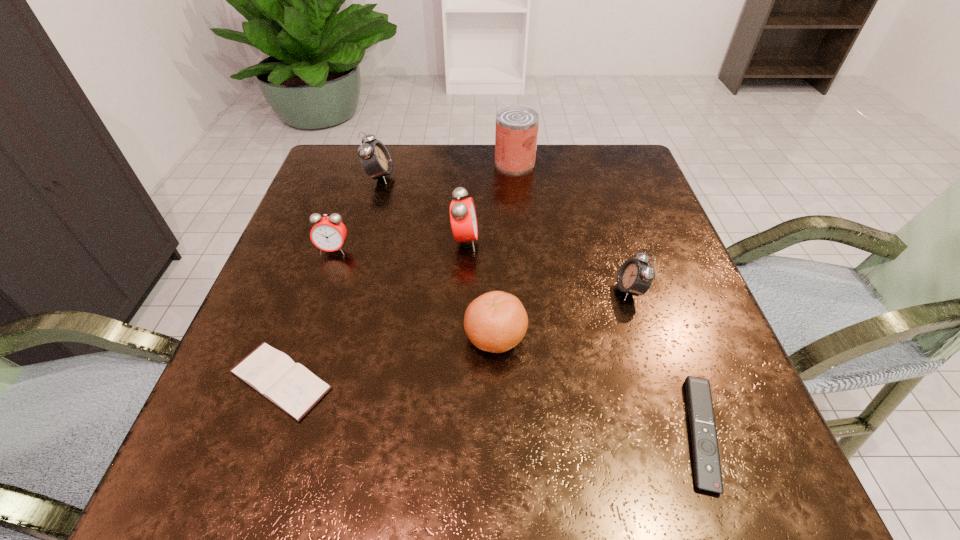
Where is `vacant region between the fifth farthest object and the diary`? This screenshot has height=540, width=960. vacant region between the fifth farthest object and the diary is located at coordinates (455, 335).

Find the location of `free area in between the farther white alarm clock and the diary`. free area in between the farther white alarm clock and the diary is located at coordinates (330, 279).

At what (x,y) coordinates should I click in order to perform the action: click on unoccupied area between the left red alarm clock and the diary. Please return your answer as a coordinate pair (x, y). Looking at the image, I should click on (307, 315).

Where is `free space between the fourth nearest object and the farther white alarm clock`? free space between the fourth nearest object and the farther white alarm clock is located at coordinates (505, 233).

Where is `empty location between the diary and the remote control`? This screenshot has height=540, width=960. empty location between the diary and the remote control is located at coordinates (491, 407).

Identify which object is the third closest to the clementine. Please provide its 2D coordinates. Your answer should be formatted as a tuple, i.e. [(x, y)], where the tuple contains the x and y coordinates of a point satisfying the conditions above.

[(290, 386)]

Identify which object is located as the sixth nearest to the remote control. Please provide its 2D coordinates. Your answer should be formatted as a tuple, i.e. [(x, y)], where the tuple contains the x and y coordinates of a point satisfying the conditions above.

[(328, 233)]

Locate an element on the screen. alarm clock that is the closest to the brown diary is located at coordinates (328, 233).

Identify which alarm clock is the third closest to the right red alarm clock. Please provide its 2D coordinates. Your answer should be formatted as a tuple, i.e. [(x, y)], where the tuple contains the x and y coordinates of a point satisfying the conditions above.

[(635, 277)]

In order to click on vacant space that satisfies the following two spatial constraints: 1. on the face of the remote control; 2. on the left side of the smaller white alarm clock in this screenshot , I will do `click(676, 433)`.